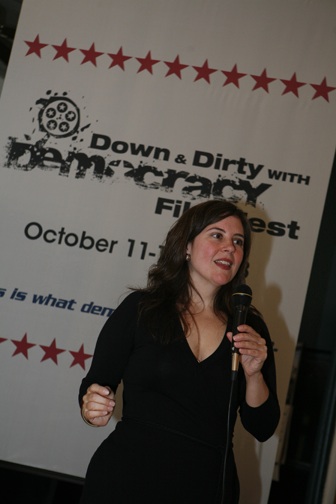
What are the coordinates of `white poster` in the screenshot? It's located at (87, 207).